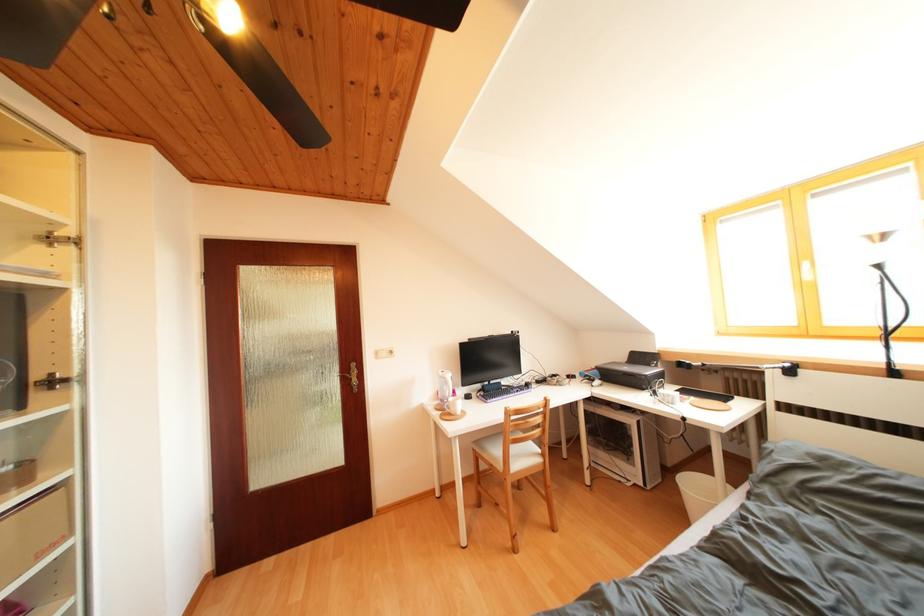
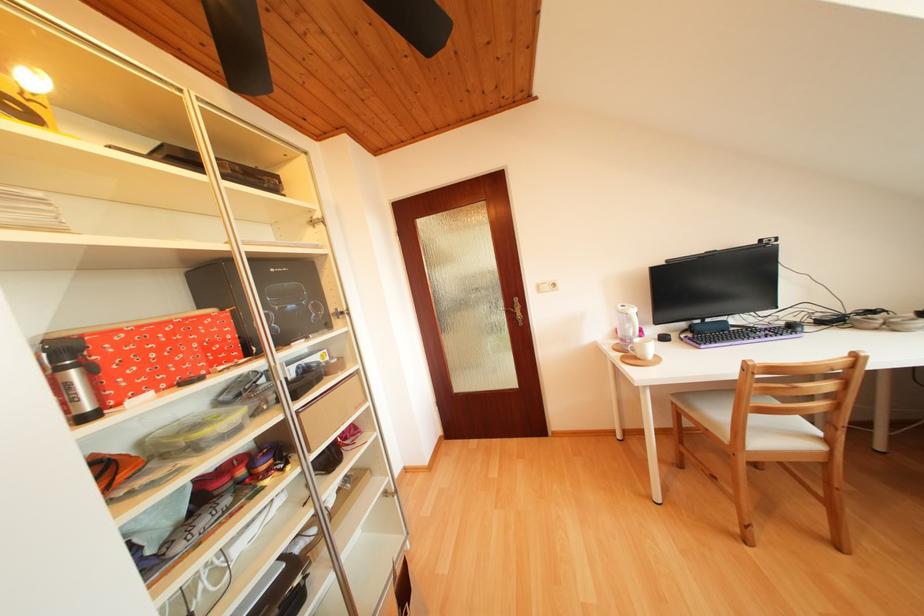
The point at (463, 408) is marked in the first image. Where is the corresponding point in the second image?

(650, 350)